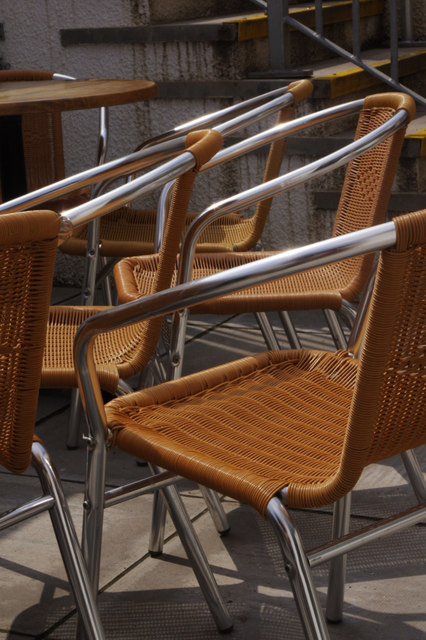
You are a GUI agent. You are given a task and a screenshot of the screen. Output one action in this format:
    pyautogui.click(x=<x>, y=<y>)
    Task: Click on the hand rails
    
    Given the screenshot: What is the action you would take?
    pyautogui.click(x=356, y=27)